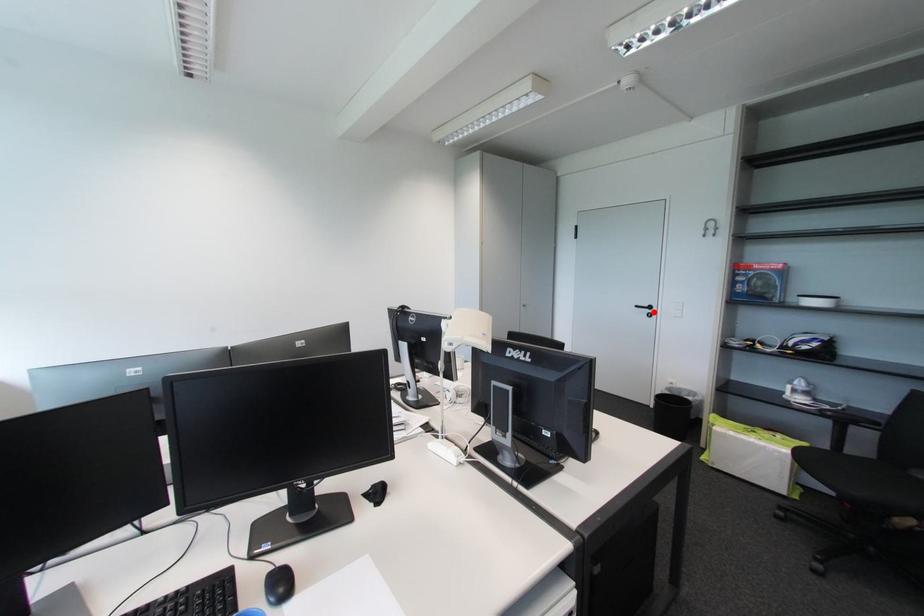
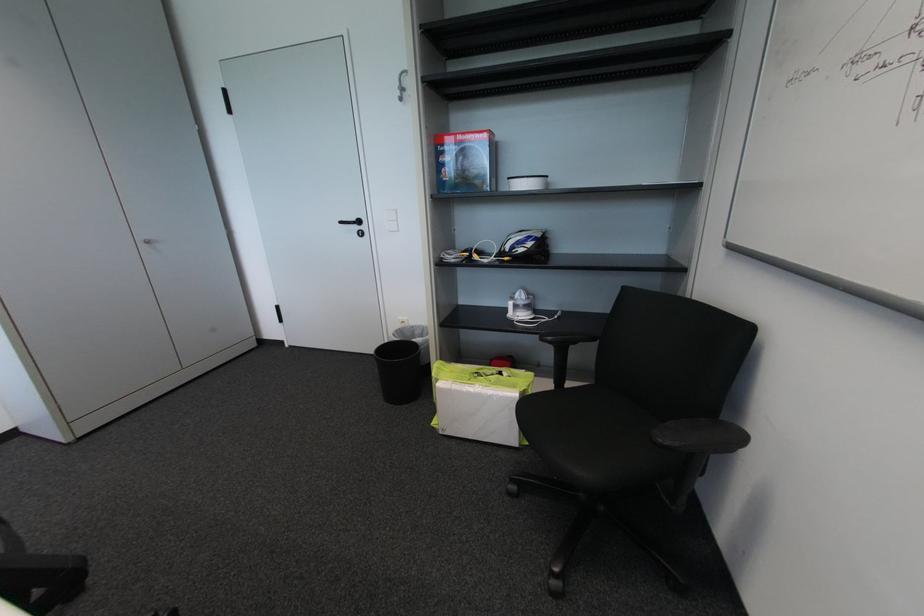
Where in the second image is the point corresponding to the highlighted location from the first image?

(362, 229)